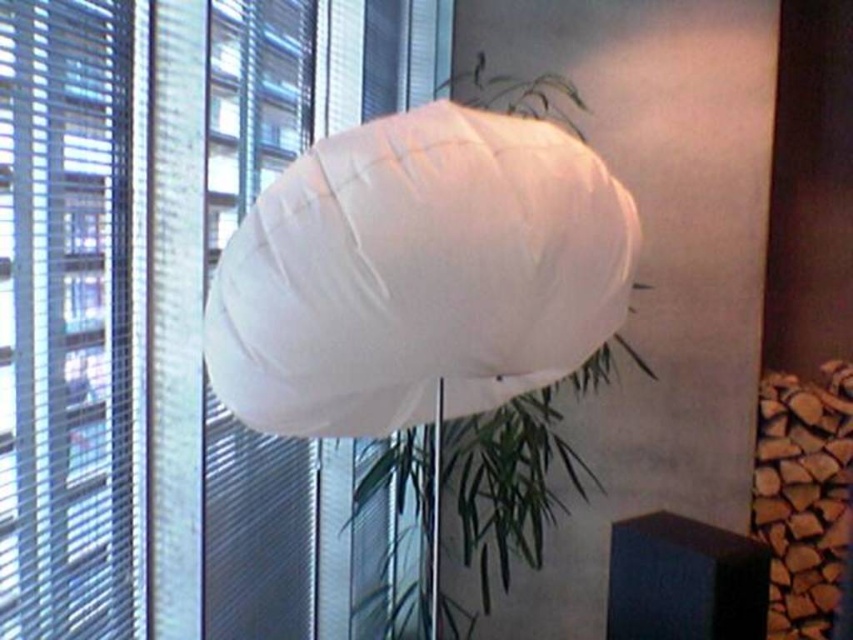
Between point (309, 90) and point (376, 230), which one is positioned behind?

The point (309, 90) is behind.

What do you see at coordinates (173, 316) in the screenshot? The width and height of the screenshot is (853, 640). I see `white matte blind at upper center` at bounding box center [173, 316].

Where is `white matte blind at upper center`? The image size is (853, 640). white matte blind at upper center is located at coordinates (173, 316).

From the picture: Does white fabric lamp at center have a lesser width compared to transparent plastic blinds at left?

No, white fabric lamp at center is not thinner than transparent plastic blinds at left.

Can you confirm if white fabric lamp at center is shorter than transparent plastic blinds at left?

Yes.

The height and width of the screenshot is (640, 853). In order to click on white fabric lamp at center in this screenshot , I will do `click(418, 275)`.

In the scene shown: Can you confirm if white matte blind at upper center is smaller than transparent plastic blinds at left?

Actually, white matte blind at upper center might be larger than transparent plastic blinds at left.

Is point (77, 212) less distant than point (68, 611)?

Yes, point (77, 212) is closer to viewer.

Where is `white matte blind at upper center`? The width and height of the screenshot is (853, 640). white matte blind at upper center is located at coordinates (173, 316).